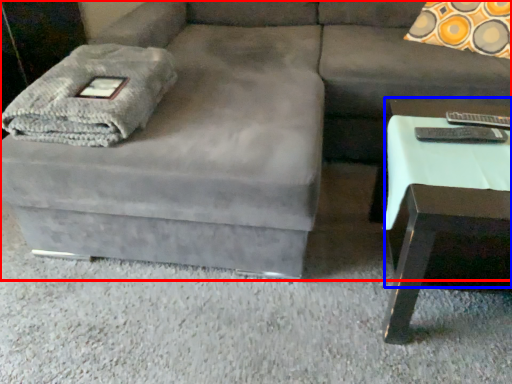
Question: Among these objects, which one is nearest to the camera, studio couch (highlighted by a red box) or side table (highlighted by a blue box)?

Choices:
 (A) studio couch
 (B) side table

Answer: (A)